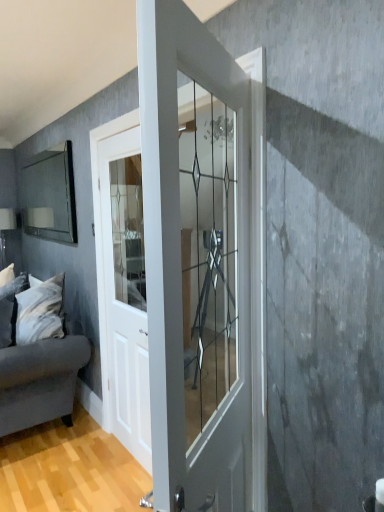
Question: Is matte glass mirror at left wider or thinner than white soft pillow at left?

Choices:
 (A) thin
 (B) wide

Answer: (A)

Question: From a real-world perspective, is matte glass mirror at left physically located above or below white soft pillow at left?

Choices:
 (A) below
 (B) above

Answer: (B)

Question: Estimate the real-world distances between objects in this image. Which object is farther from the matte glass mirror at left?

Choices:
 (A) velvet gray couch at left
 (B) white glossy door at center, which is the 2th door in front-to-back order
 (C) clear glass door at center, positioned as the first door in right-to-left order
 (D) white soft pillow at left

Answer: (C)

Question: Which object is positioned farthest from the matte glass mirror at left?

Choices:
 (A) velvet gray couch at left
 (B) clear glass door at center, positioned as the first door in right-to-left order
 (C) white soft pillow at left
 (D) white glossy door at center, which is the first door in back-to-front order

Answer: (B)